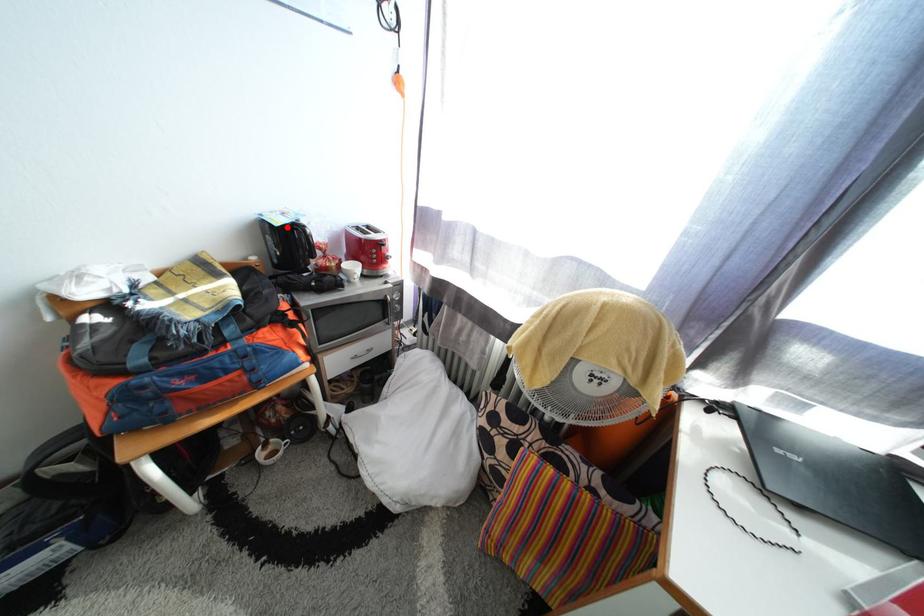
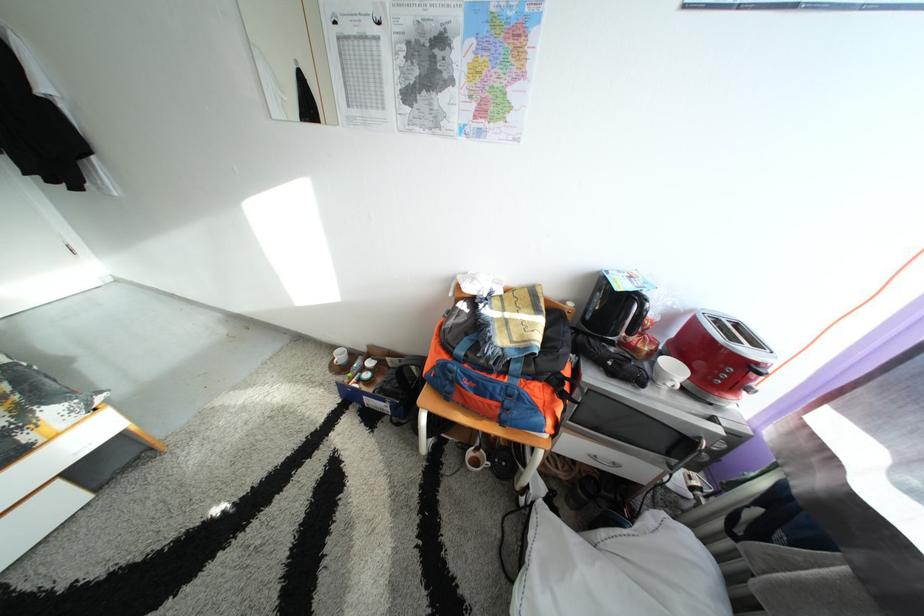
Question: I am providing you with two images of the same scene from different viewpoints. A red point is marked on the first image. Can you still see the location of the red point in image 2?

Choices:
 (A) Yes
 (B) No

Answer: (A)